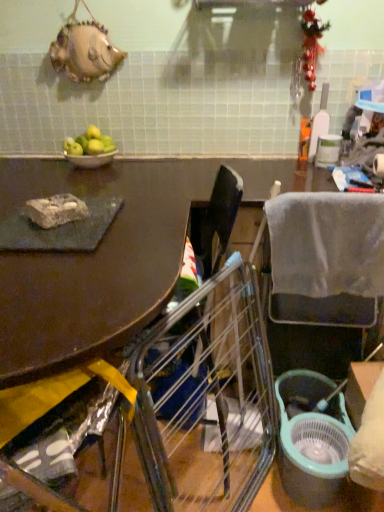
Find the location of a particular element. The width and height of the screenshot is (384, 512). empty space that is ontop of metallic silver bowl at upper left (from a real-world perspective) is located at coordinates (89, 152).